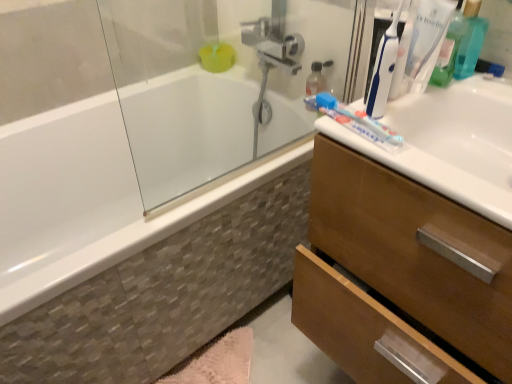
Question: Is wooden cabinet at right taller or shorter than translucent plastic toothbrush at upper right, the second toothbrush in the left-to-right sequence?

Choices:
 (A) short
 (B) tall

Answer: (B)

Question: Considering the relative positions of wooden cabinet at right and translucent plastic toothbrush at upper right, the first toothbrush viewed from the right, in the image provided, is wooden cabinet at right to the left or to the right of translucent plastic toothbrush at upper right, the first toothbrush viewed from the right,?

Choices:
 (A) left
 (B) right

Answer: (B)

Question: Which of these objects is positioned closest to the white glossy sink at upper right?

Choices:
 (A) translucent plastic toothbrush at upper right, the first toothbrush viewed from the right
 (B) blue plastic toothbrush at upper right, marked as the second toothbrush in a right-to-left arrangement
 (C) wooden cabinet at right
 (D) white glossy bathtub at left
 (E) pink fluffy bath mat at lower center

Answer: (A)

Question: Which is farther from the wooden cabinet at right?

Choices:
 (A) blue plastic toothbrush at upper right, acting as the 1th toothbrush starting from the left
 (B) pink fluffy bath mat at lower center
 (C) white glossy sink at upper right
 (D) white glossy bathtub at left
 (E) translucent plastic toothbrush at upper right, the second toothbrush in the left-to-right sequence

Answer: (B)